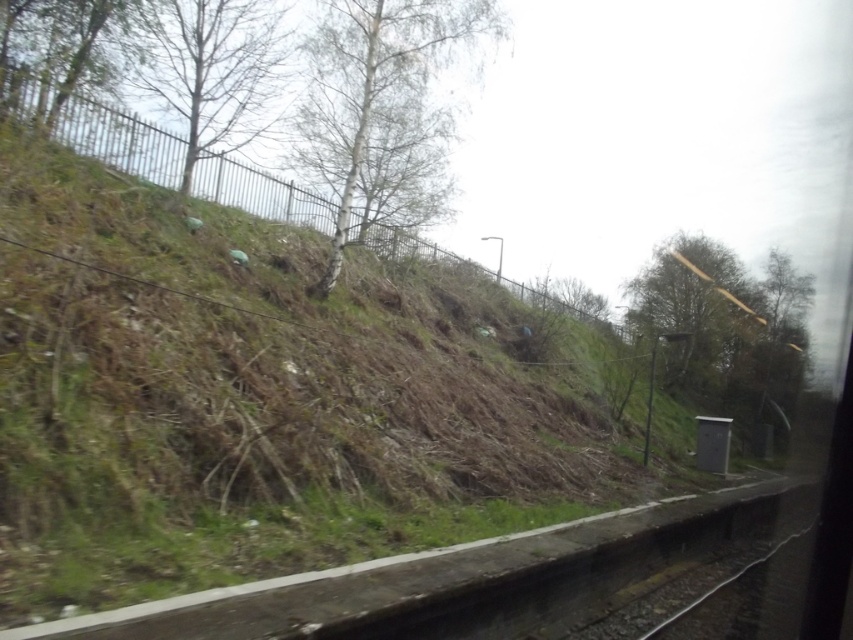
Question: Which point is closer to the camera?

Choices:
 (A) green leafy tree at upper center
 (B) black metal fence at upper left
 (C) bare wood tree at upper left
 (D) bare birch at center

Answer: (B)

Question: Considering the relative positions of bare wood tree at upper left and green leafy tree at upper left in the image provided, where is bare wood tree at upper left located with respect to green leafy tree at upper left?

Choices:
 (A) above
 (B) below

Answer: (A)

Question: Is bare birch at center bigger than green leafy tree at upper left?

Choices:
 (A) no
 (B) yes

Answer: (A)

Question: Which object is farther from the camera taking this photo?

Choices:
 (A) green leafy tree at upper center
 (B) bare wood tree at upper left
 (C) black metal fence at upper left
 (D) bare birch at center

Answer: (A)

Question: Which object is positioned farthest from the bare wood tree at upper left?

Choices:
 (A) green leafy tree at upper left
 (B) bare birch at center
 (C) black metal fence at upper left

Answer: (B)

Question: Does bare birch at center come behind bare wood tree at upper left?

Choices:
 (A) no
 (B) yes

Answer: (B)